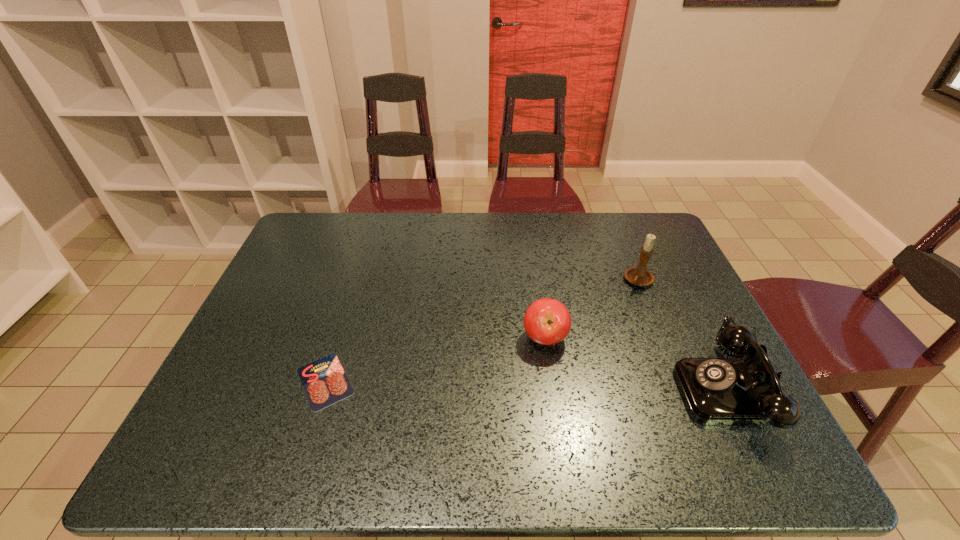
Find the location of a particular element. object that is positioned at the near right corner is located at coordinates (745, 390).

Find the location of a particular element. This screenshot has height=540, width=960. free space at the far edge of the desktop is located at coordinates (524, 248).

In the image, there is a desktop. At what (x,y) coordinates should I click in order to perform the action: click on free space at the near edge. Please return your answer as a coordinate pair (x, y). The image size is (960, 540). Looking at the image, I should click on (303, 420).

What are the coordinates of `free space at the left edge of the desktop` in the screenshot? It's located at (276, 378).

Locate an element on the screen. vacant space at the right edge of the desktop is located at coordinates (656, 271).

You are a GUI agent. You are given a task and a screenshot of the screen. Output one action in this format:
    pyautogui.click(x=<x>, y=<y>)
    Task: Click on the vacant space at the far left corner of the desktop
    The width and height of the screenshot is (960, 540).
    Given the screenshot: What is the action you would take?
    pyautogui.click(x=312, y=225)

At what (x,y) coordinates should I click in order to perform the action: click on vacant space at the far right corner of the desktop. Please return your answer as a coordinate pair (x, y). This screenshot has width=960, height=540. Looking at the image, I should click on (656, 244).

Identify the location of empty space between the leftmost object and the second object from left to right. (435, 360).

Identify the location of free space between the third object from right to left and the salami. (435, 360).

I want to click on unoccupied position between the apple and the tallest object, so click(592, 309).